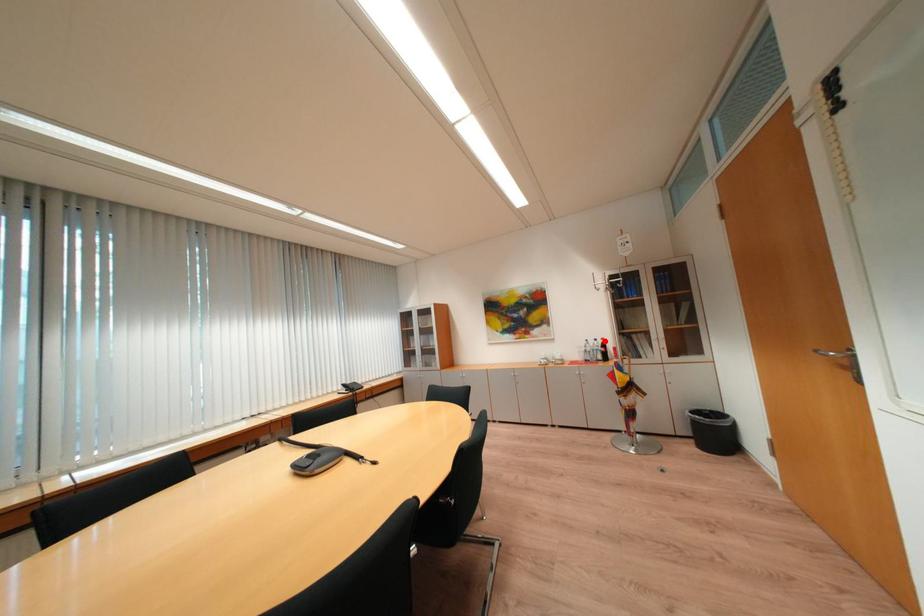
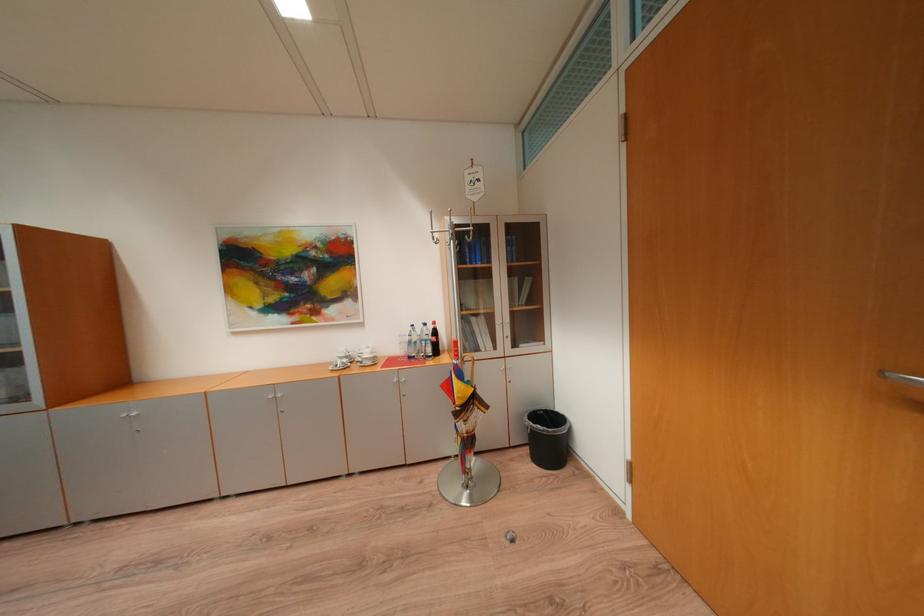
Locate, in the second image, the point that corresponds to the highlighted location in the first image.

(434, 326)